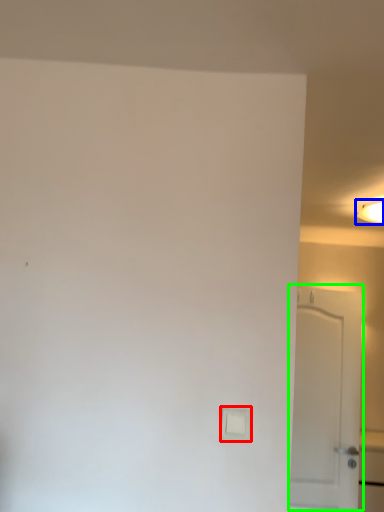
Question: Considering the real-world distances, which object is closest to light switch (highlighted by a red box)? lighting (highlighted by a blue box) or door (highlighted by a green box).

Choices:
 (A) lighting
 (B) door

Answer: (B)